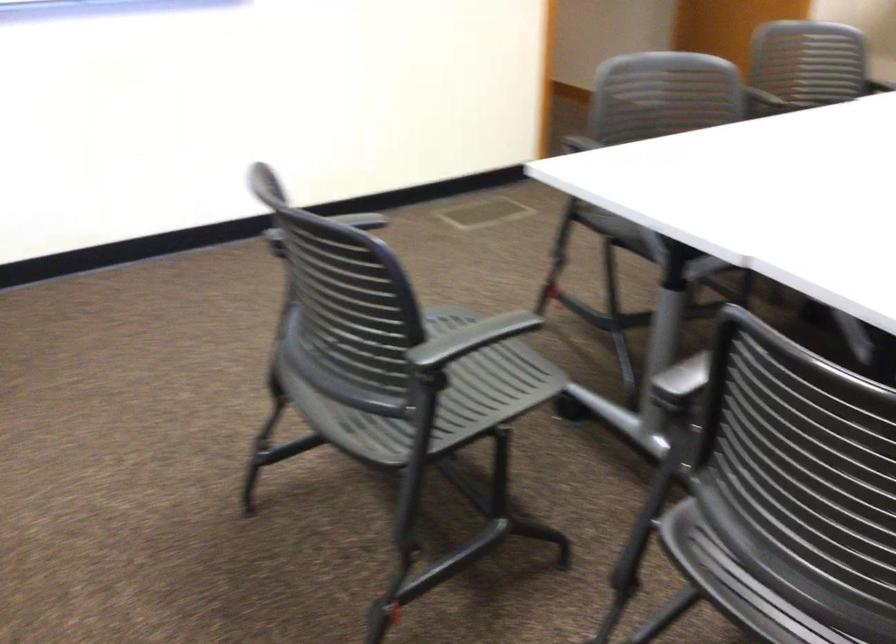
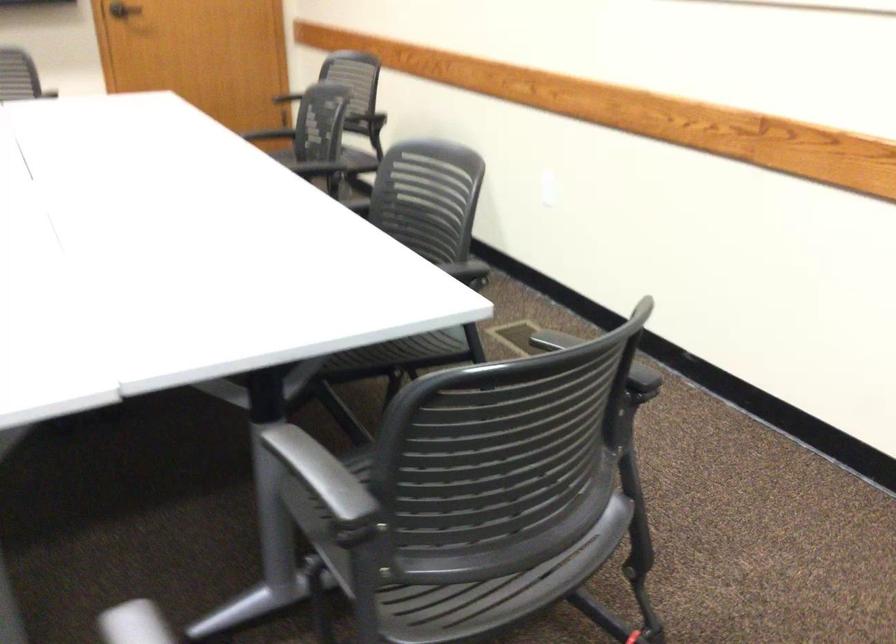
Locate, in the second image, the point that corresponds to (789,570) in the first image.

(496, 590)